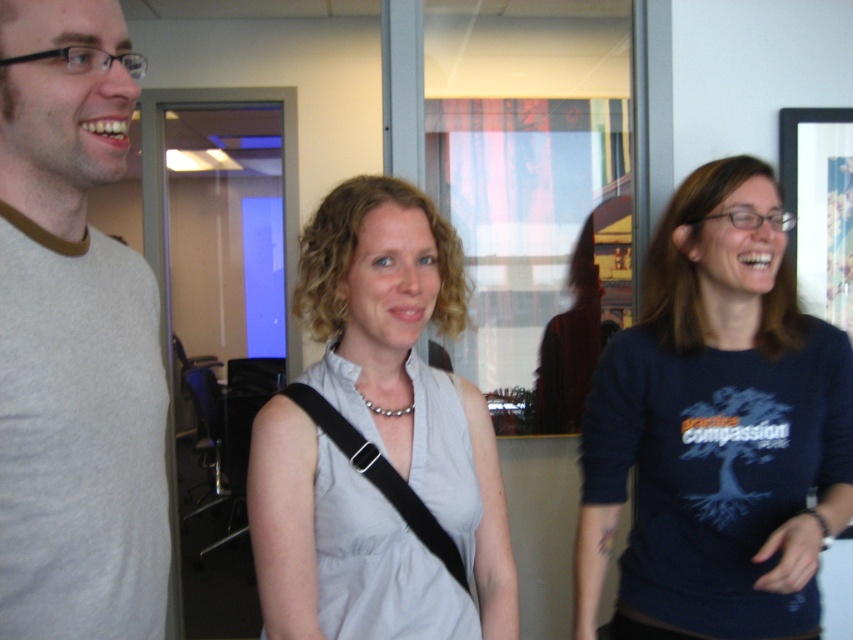
Which is above, dark blue cotton shirt at center or light gray fabric dress at center?

light gray fabric dress at center is above.

This screenshot has height=640, width=853. What do you see at coordinates (717, 428) in the screenshot?
I see `dark blue cotton shirt at center` at bounding box center [717, 428].

I want to click on dark blue cotton shirt at center, so click(x=717, y=428).

This screenshot has height=640, width=853. What are the coordinates of `dark blue cotton shirt at center` in the screenshot? It's located at (717, 428).

Is dark blue cotton shirt at center further to camera compared to gray cotton t-shirt at left?

Yes, it is.

Who is positioned more to the right, dark blue cotton shirt at center or gray cotton t-shirt at left?

Positioned to the right is dark blue cotton shirt at center.

Locate an element on the screen. The image size is (853, 640). dark blue cotton shirt at center is located at coordinates (717, 428).

This screenshot has width=853, height=640. In order to click on dark blue cotton shirt at center in this screenshot , I will do `click(717, 428)`.

Between light gray fabric dress at center and gray cotton t-shirt at left, which one is positioned higher?

Positioned higher is gray cotton t-shirt at left.

Who is lower down, light gray fabric dress at center or gray cotton t-shirt at left?

Positioned lower is light gray fabric dress at center.

Who is more forward, (317, 566) or (132, 598)?

Positioned in front is point (132, 598).

Locate an element on the screen. The height and width of the screenshot is (640, 853). light gray fabric dress at center is located at coordinates (379, 440).